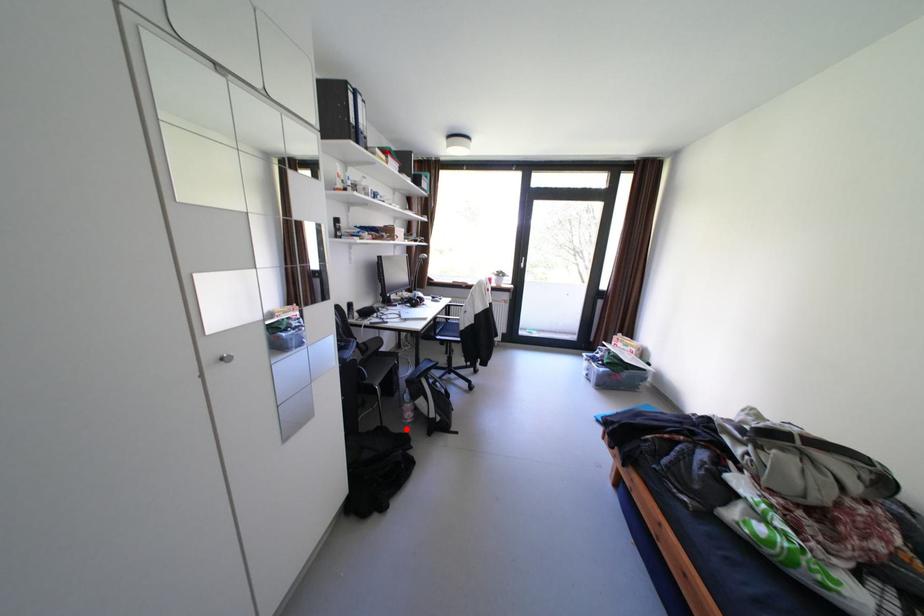
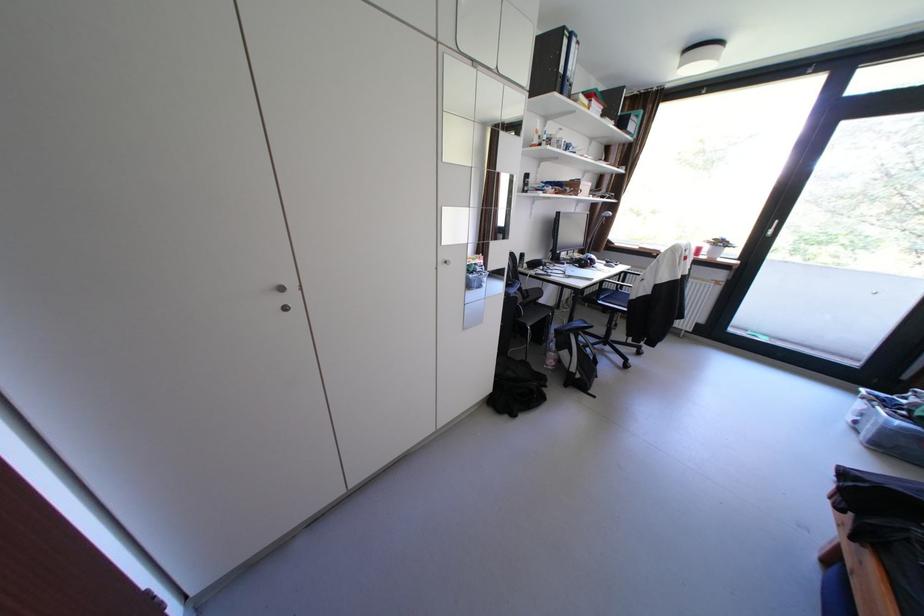
Question: I am providing you with two images of the same scene from different viewpoints. Image1 has a red point marked. In image2, the corresponding 3D location appears at what relative position? Reply with the corresponding letter.

Choices:
 (A) Closer
 (B) Farther

Answer: (A)